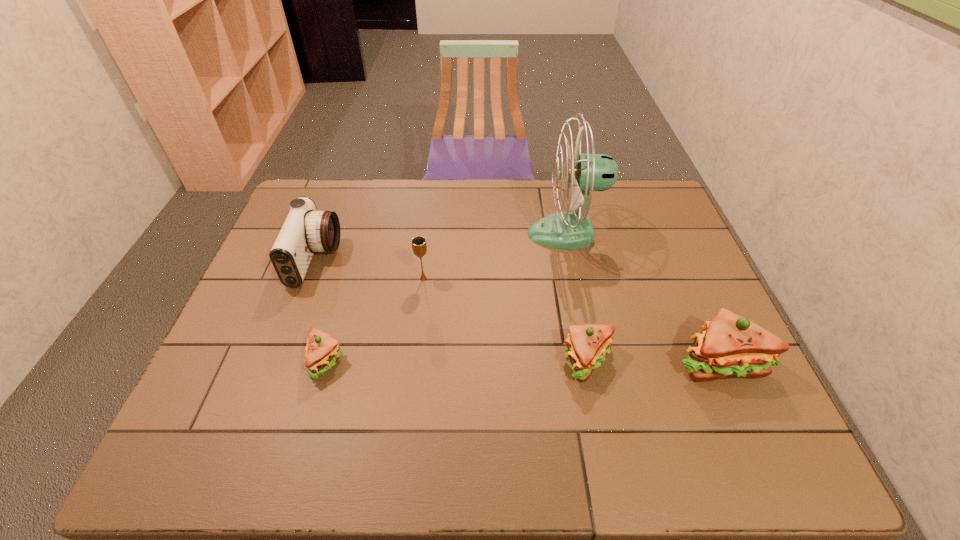
Identify the location of the leftmost sandwich. This screenshot has width=960, height=540. point(322,351).

Where is `the fifth object from right to left`? This screenshot has height=540, width=960. the fifth object from right to left is located at coordinates (322, 351).

The width and height of the screenshot is (960, 540). In order to click on the second sandwich from left to right in this screenshot , I will do `click(587, 345)`.

Image resolution: width=960 pixels, height=540 pixels. I want to click on the rightmost sandwich, so click(x=730, y=346).

Where is `the rightmost object`? The image size is (960, 540). the rightmost object is located at coordinates (730, 346).

Identify the location of chalice. (419, 246).

You are a GUI agent. You are given a task and a screenshot of the screen. Output one action in this format:
    pyautogui.click(x=<x>, y=<y>)
    Task: Click on the fan
    
    Given the screenshot: What is the action you would take?
    pyautogui.click(x=572, y=229)

Locate an element on the screen. the leftmost object is located at coordinates coord(305,231).

At what (x,y) coordinates should I click in order to perform the action: click on free space located on the right of the fifth object from right to left. Please return your answer as a coordinate pair (x, y). The height and width of the screenshot is (540, 960). Looking at the image, I should click on (499, 361).

I want to click on blank area located on the front of the second tallest sandwich, so click(x=597, y=407).